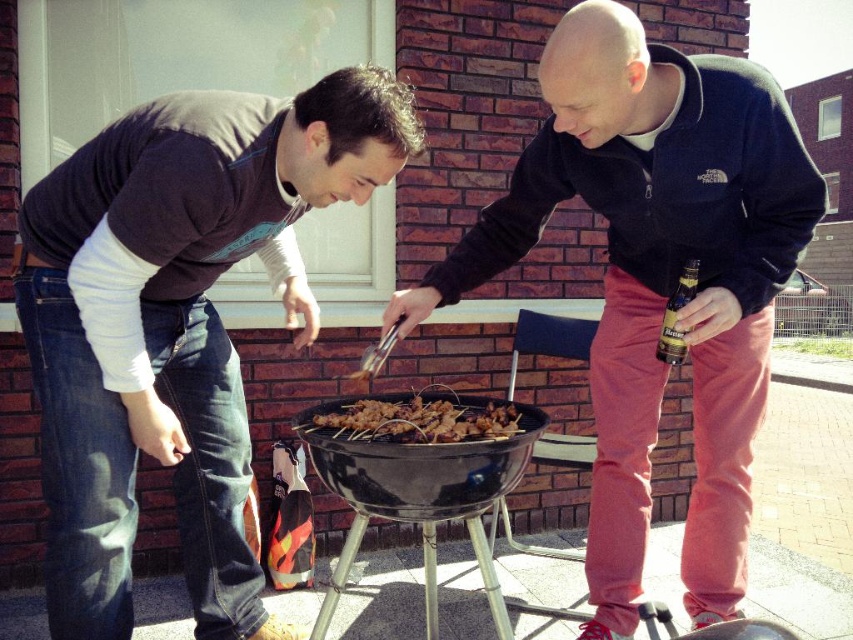
Who is more distant from viewer, (730, 259) or (437, 428)?

Positioned behind is point (730, 259).

Does point (756, 376) lie in front of point (405, 420)?

No.

Where is `matte black grill at center`? This screenshot has width=853, height=640. matte black grill at center is located at coordinates (657, 276).

Image resolution: width=853 pixels, height=640 pixels. Identify the location of matte black grill at center. (657, 276).

Image resolution: width=853 pixels, height=640 pixels. Find the location of `matte black grill at center`. matte black grill at center is located at coordinates [657, 276].

Can you confirm if matte black grill at center is positioned to the left of black matte barbecue grill at center?

No, matte black grill at center is not to the left of black matte barbecue grill at center.

This screenshot has height=640, width=853. Describe the element at coordinates (657, 276) in the screenshot. I see `matte black grill at center` at that location.

Locate an element on the screen. matte black grill at center is located at coordinates (657, 276).

Locate an element on the screen. The image size is (853, 640). matte black shirt at center is located at coordinates (177, 323).

Is matte black shirt at center behind black matte barbecue grill at center?

No, matte black shirt at center is closer to the viewer.

Is point (120, 173) positioned in front of point (303, 436)?

Yes, it is in front of point (303, 436).

This screenshot has width=853, height=640. What are the coordinates of `matte black shirt at center` in the screenshot? It's located at (177, 323).